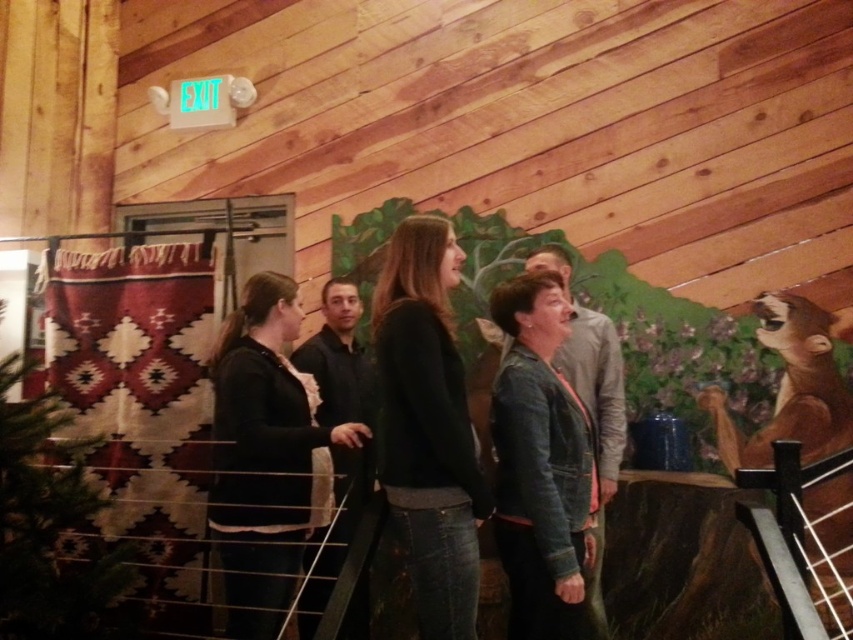
You are a photographer trying to capture a clear shot of both the denim jacket at center and the brown furry bear at right. Since you can only focus on one subject at a time, which one should you choose to ensure the other remains in the background?

The denim jacket at center is closer to the viewer than the brown furry bear at right, so focusing on the denim jacket at center will keep the brown furry bear at right in the background.

From the picture: You are standing at the center of the room and want to place a new decorative item exactly at the point marked as point (142, 406). Which object is currently occupying that location?

The red and white woven quilt at left is located at point (142, 406).